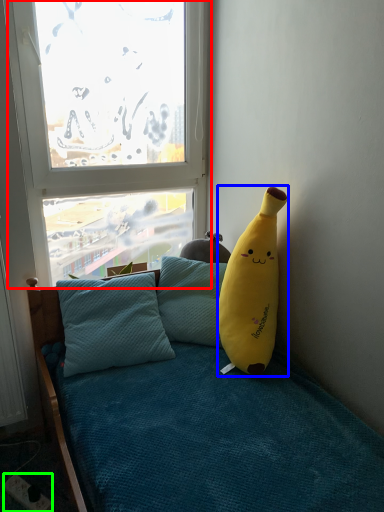
Question: Based on their relative distances, which object is nearer to window (highlighted by a red box)? Choose from banana (highlighted by a blue box) and power outlet (highlighted by a green box).

Choices:
 (A) banana
 (B) power outlet

Answer: (A)